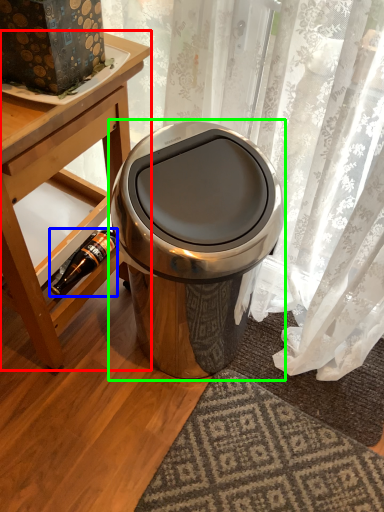
Question: Estimate the real-world distances between objects in this image. Which object is farther from table (highlighted by a red box), bottle (highlighted by a blue box) or waste container (highlighted by a green box)?

Choices:
 (A) bottle
 (B) waste container

Answer: (B)